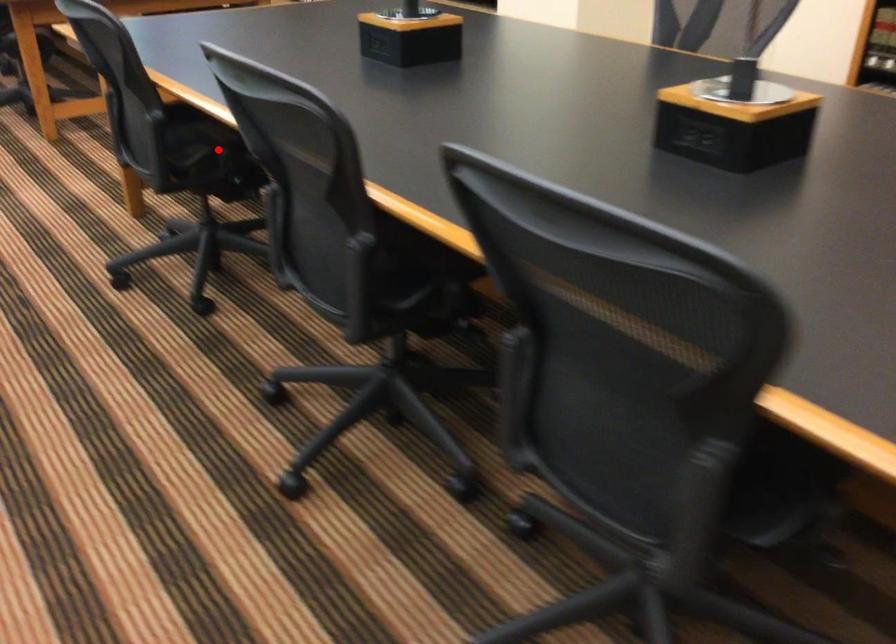
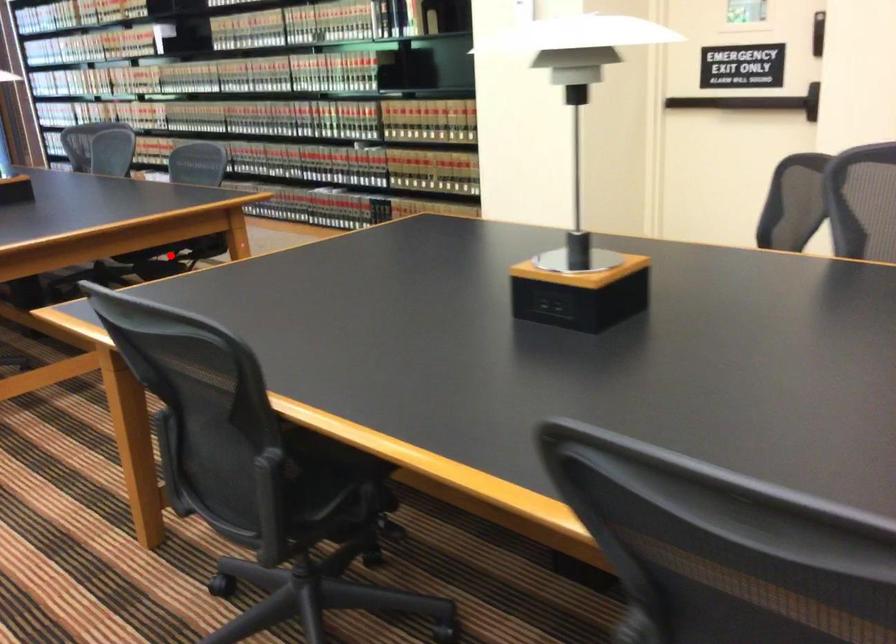
I am providing you with two images of the same scene from different viewpoints. A red point is marked on the first image and another point is marked on the second image. Does the point marked in image1 correspond to the same location as the one in image2?

No